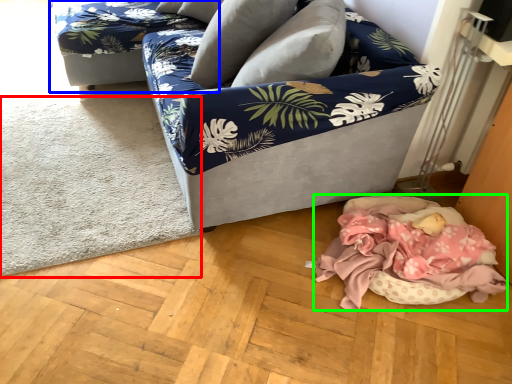
Question: Which object is the closest to the mat (highlighted by a red box)? Choose among these: couch (highlighted by a blue box) or mattress (highlighted by a green box).

Choices:
 (A) couch
 (B) mattress

Answer: (A)